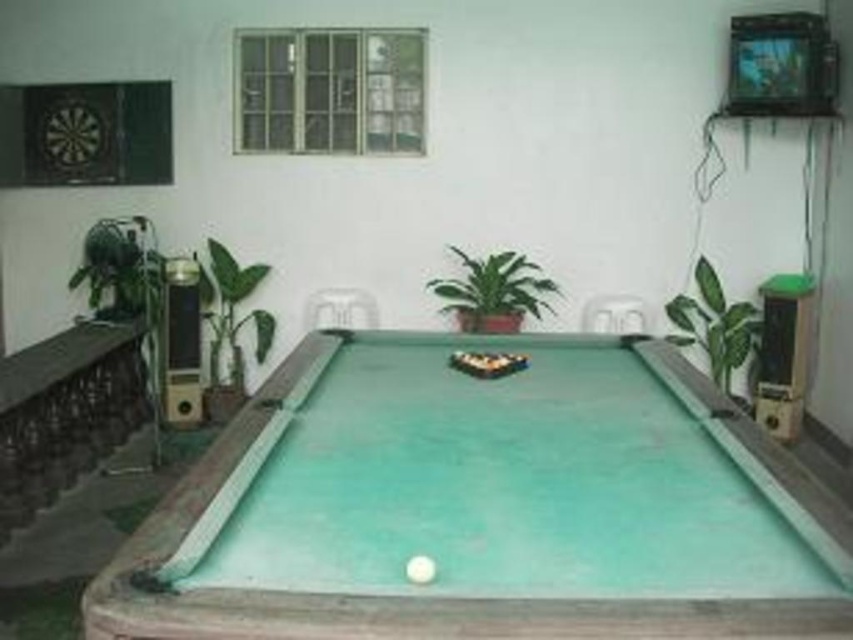
Question: Which point is farther from the camera taking this photo?

Choices:
 (A) (526, 278)
 (B) (207, 282)

Answer: (B)

Question: Estimate the real-world distances between objects in this image. Which object is closer to the green felt billiard table at center?

Choices:
 (A) green leafy plant at left
 (B) green glossy plant at center

Answer: (B)

Question: Which point is closer to the camera?

Choices:
 (A) (454, 280)
 (B) (706, 314)
 (C) (235, 320)
 (D) (115, 566)

Answer: (D)

Question: Does green felt billiard table at center have a smaller size compared to green glossy plant at center?

Choices:
 (A) yes
 (B) no

Answer: (B)

Question: Can you confirm if green leafy plant at right is positioned below green leafy plant at left?

Choices:
 (A) no
 (B) yes

Answer: (B)

Question: In this image, where is green leafy plant at right located relative to green leafy plant at left?

Choices:
 (A) right
 (B) left

Answer: (A)